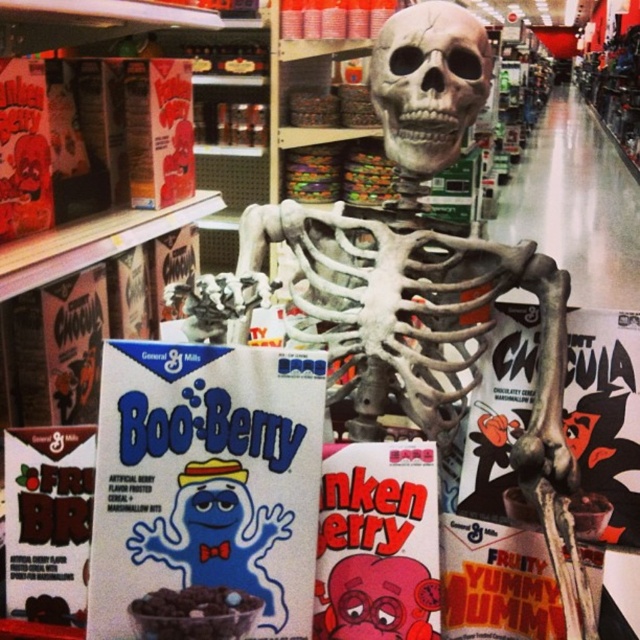
Question: Does fruity yummy mummy cereal at center appear under smooth chocolate cereal at center?

Choices:
 (A) yes
 (B) no

Answer: (A)

Question: Can you confirm if matte blue ghost cereal box at center is thinner than fruity yummy mummy cereal at center?

Choices:
 (A) no
 (B) yes

Answer: (B)

Question: Which point is farther to the camera?

Choices:
 (A) gray matte skull at center
 (B) smooth chocolate cereal at center
 (C) fruity yummy mummy cereal at center

Answer: (C)

Question: Estimate the real-world distances between objects in this image. Which object is closer to the fruity yummy mummy cereal at center?

Choices:
 (A) matte blue ghost cereal box at center
 (B) gray matte skull at center

Answer: (A)

Question: Can you confirm if fruity yummy mummy cereal at center is wider than smooth chocolate cereal at center?

Choices:
 (A) yes
 (B) no

Answer: (A)

Question: Which point is closer to the camera taking this photo?

Choices:
 (A) (420, 26)
 (B) (132, 604)
 (C) (140, 609)

Answer: (B)